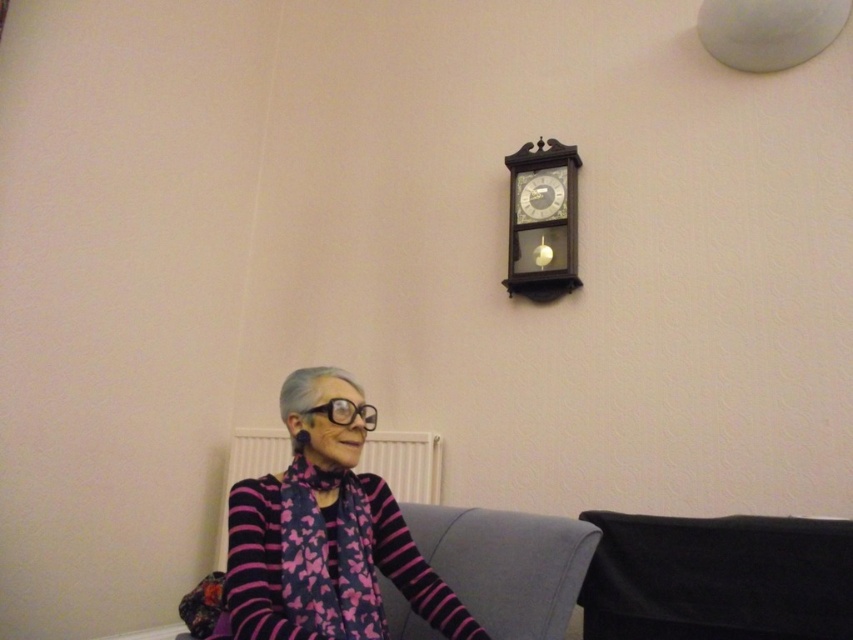
You are an interior designer planning to hang a new painting between the wooden clock at upper center and the white plastic radiator at lower center. Based on their positions, where should you place the painting to ensure it is centered between them?

The wooden clock at upper center is positioned on the right side of the white plastic radiator at lower center. To center the painting between them, place it slightly to the right of the radiator and below the clock.

You are an interior designer assessing the placement of the wooden clock at upper center and the white plastic radiator at lower center. Based on their positions, which object is located higher in the image?

The wooden clock at upper center is located higher in the image as it is positioned above the white plastic radiator at lower center.

You are an interior designer planning to hang a new painting. You see the black fabric at lower right and the wooden clock at upper center. Which object is located lower in the image?

The black fabric at lower right is positioned under the wooden clock at upper center, so it is located lower in the image.